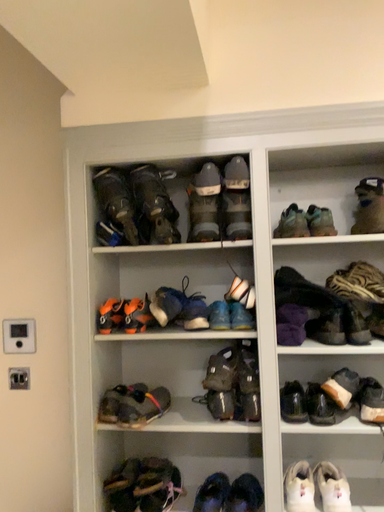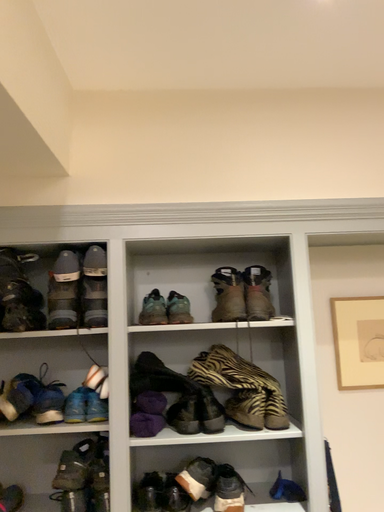
Question: Which way did the camera rotate in the video?

Choices:
 (A) rotated downward
 (B) rotated upward

Answer: (B)